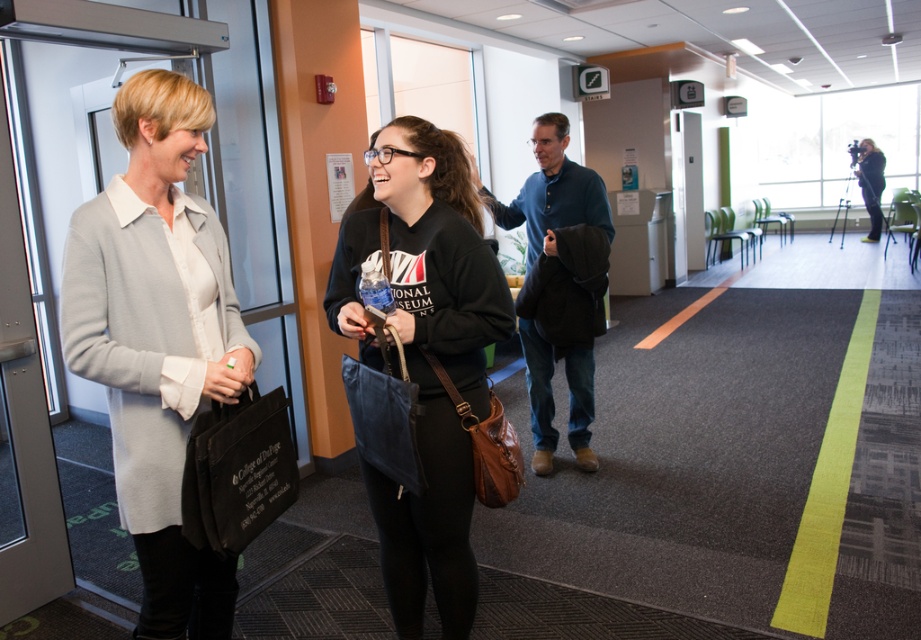
Is point (193, 125) farther from viewer compared to point (548, 445)?

No, it is in front of (548, 445).

You are a GUI agent. You are given a task and a screenshot of the screen. Output one action in this format:
    pyautogui.click(x=<x>, y=<y>)
    Task: Click on the light gray sweater at left
    This screenshot has height=640, width=921.
    Given the screenshot: What is the action you would take?
    pyautogui.click(x=157, y=340)

Does light gray sweater at left appear under black matte sweatshirt at center?

No.

Is light gray sweater at left wider than black matte sweatshirt at center?

Incorrect, light gray sweater at left's width does not surpass black matte sweatshirt at center's.

The height and width of the screenshot is (640, 921). Identify the location of light gray sweater at left. (157, 340).

This screenshot has height=640, width=921. Find the location of `light gray sweater at left`. light gray sweater at left is located at coordinates (157, 340).

Between point (465, 205) and point (548, 468), which one is positioned behind?

The point (548, 468) is behind.

Which of these two, black matte sweatshirt at center or blue cotton shirt at center, stands taller?

black matte sweatshirt at center is taller.

Image resolution: width=921 pixels, height=640 pixels. What do you see at coordinates (424, 356) in the screenshot?
I see `black matte sweatshirt at center` at bounding box center [424, 356].

Find the location of a particular element. black matte sweatshirt at center is located at coordinates (424, 356).